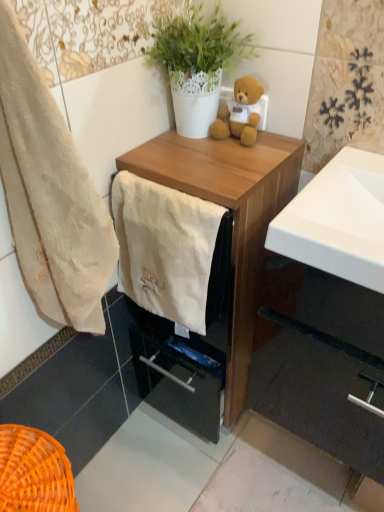
Question: Is wooden chest of drawers at center to the left of beige cotton towel at left, which is counted as the 2th towel/napkin, starting from the right, from the viewer's perspective?

Choices:
 (A) yes
 (B) no

Answer: (B)

Question: Is wooden chest of drawers at center oriented away from beige cotton towel at left, which is counted as the 2th towel/napkin, starting from the right?

Choices:
 (A) no
 (B) yes

Answer: (A)

Question: Can you confirm if wooden chest of drawers at center is wider than beige cotton towel at left, which is counted as the 2th towel/napkin, starting from the right?

Choices:
 (A) yes
 (B) no

Answer: (A)

Question: Could you tell me if wooden chest of drawers at center is facing beige cotton towel at left, which is counted as the 2th towel/napkin, starting from the right?

Choices:
 (A) yes
 (B) no

Answer: (A)

Question: From a real-world perspective, is wooden chest of drawers at center located higher than beige cotton towel at left, which is counted as the 2th towel/napkin, starting from the right?

Choices:
 (A) no
 (B) yes

Answer: (A)

Question: Is white soft towel at center, the first towel/napkin in the right-to-left sequence, in front of or behind wooden chest of drawers at center in the image?

Choices:
 (A) front
 (B) behind

Answer: (B)

Question: From a real-world perspective, is white soft towel at center, which is the 2th towel/napkin from left to right, physically located above or below wooden chest of drawers at center?

Choices:
 (A) below
 (B) above

Answer: (B)

Question: Considering the positions of white soft towel at center, the first towel/napkin in the right-to-left sequence, and wooden chest of drawers at center in the image, is white soft towel at center, the first towel/napkin in the right-to-left sequence, wider or thinner than wooden chest of drawers at center?

Choices:
 (A) thin
 (B) wide

Answer: (A)

Question: Would you say white soft towel at center, the first towel/napkin in the right-to-left sequence, is inside or outside wooden chest of drawers at center?

Choices:
 (A) inside
 (B) outside

Answer: (A)

Question: Would you say matte wood cabinet at lower right is to the left or to the right of white soft towel at center, the first towel/napkin in the right-to-left sequence, in the picture?

Choices:
 (A) left
 (B) right

Answer: (B)

Question: Looking at their shapes, would you say matte wood cabinet at lower right is wider or thinner than white soft towel at center, which is the 2th towel/napkin from left to right?

Choices:
 (A) wide
 (B) thin

Answer: (A)

Question: From a real-world perspective, is matte wood cabinet at lower right above or below white soft towel at center, the first towel/napkin in the right-to-left sequence?

Choices:
 (A) above
 (B) below

Answer: (B)

Question: Looking at the image, does matte wood cabinet at lower right seem bigger or smaller compared to white soft towel at center, the first towel/napkin in the right-to-left sequence?

Choices:
 (A) small
 (B) big

Answer: (B)

Question: In terms of height, does beige cotton towel at left, which appears as the 1th towel/napkin when viewed from the left, look taller or shorter compared to soft plush teddy bear at upper center?

Choices:
 (A) short
 (B) tall

Answer: (B)

Question: Does point (49, 174) appear closer or farther from the camera than point (221, 119)?

Choices:
 (A) closer
 (B) farther

Answer: (A)